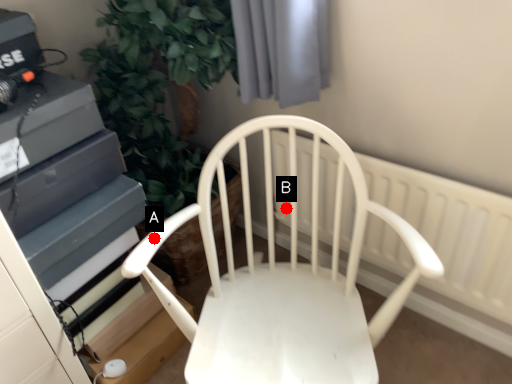
Question: Two points are circled on the image, labeled by A and B beside each circle. Which point is further to the camera?

Choices:
 (A) A is further
 (B) B is further

Answer: (B)